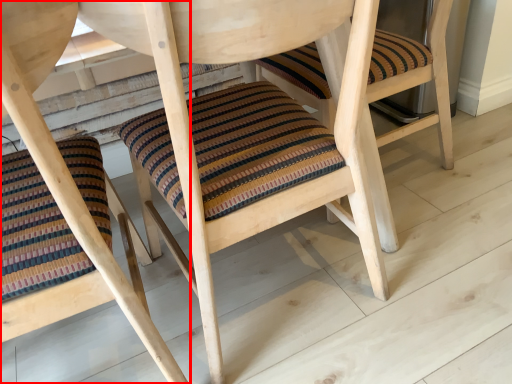
Question: From the image's perspective, what is the correct spatial positioning of chair (annotated by the red box) in reference to chair?

Choices:
 (A) above
 (B) below

Answer: (B)